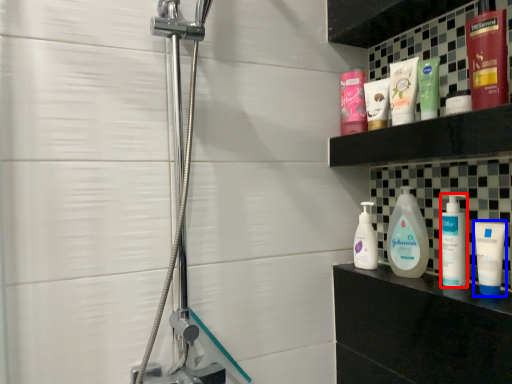
Question: Which object appears farthest to the camera in this image, toiletry (highlighted by a red box) or toiletry (highlighted by a blue box)?

Choices:
 (A) toiletry
 (B) toiletry

Answer: (A)